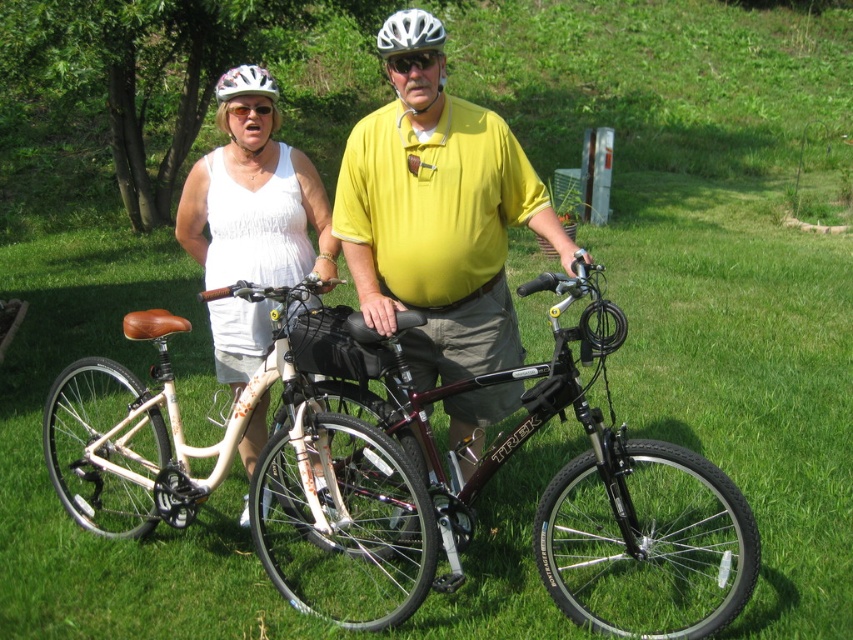
Who is shorter, white matte tank top at upper left or white glossy bicycle helmet at upper center?

white glossy bicycle helmet at upper center is shorter.

Which is in front, point (206, 172) or point (245, 77)?

Point (245, 77) is more forward.

The width and height of the screenshot is (853, 640). What are the coordinates of `white matte tank top at upper left` in the screenshot? It's located at (254, 204).

In the scene shown: Does white matte helmet at center have a lesser width compared to white glossy bicycle helmet at upper center?

In fact, white matte helmet at center might be wider than white glossy bicycle helmet at upper center.

Can you confirm if white matte helmet at center is wider than white glossy bicycle helmet at upper center?

Correct, the width of white matte helmet at center exceeds that of white glossy bicycle helmet at upper center.

Which is in front, point (392, 24) or point (238, 83)?

Point (392, 24)

In order to click on white matte helmet at center in this screenshot , I will do `click(409, 33)`.

Is matte yellow shirt at center to the right of white glossy bicycle helmet at upper center from the viewer's perspective?

Yes, matte yellow shirt at center is to the right of white glossy bicycle helmet at upper center.

Who is taller, matte yellow shirt at center or white glossy bicycle helmet at upper center?

With more height is matte yellow shirt at center.

Between point (368, 234) and point (244, 74), which one is positioned behind?

Point (244, 74)

Where is `matte yellow shirt at center`? matte yellow shirt at center is located at coordinates (438, 221).